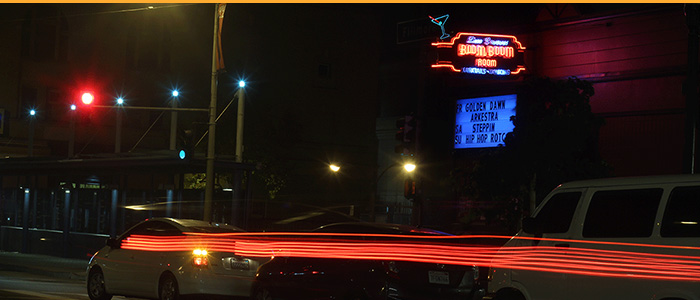
This screenshot has width=700, height=300. Find the location of `yellow lights`. yellow lights is located at coordinates (332, 164), (407, 165), (202, 252).